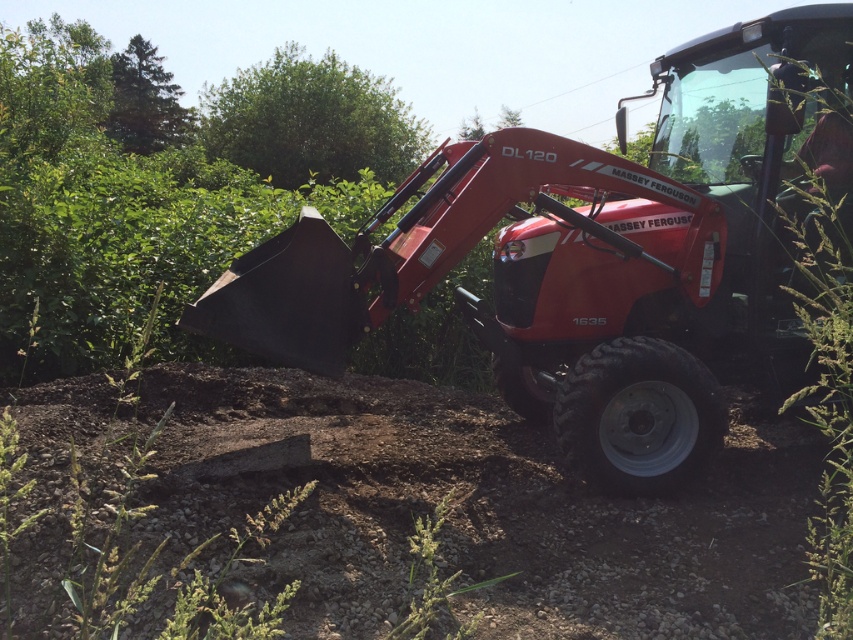
Looking at this image, you are operating a Massey Ferguson DL120 tractor with a loader bucket. You need to move the loader bucket to the brown gravel dirt track at lower center. Given the distance between the tractor and the track is 3.15 meters, can the loader bucket reach the track without moving the tractor?

The distance between the brown gravel dirt track at lower center and the camera is 3.15 meters. Since the loader bucket of the Massey Ferguson DL120 tractor has an extension range that typically reaches up to 3 meters, it cannot fully extend to 3.15 meters. Therefore, the loader bucket cannot reach the track without moving the tractor closer.

You are a farmer standing at the edge of your property. You need to drive the metallic red tractor at center to the barn located at the lower edge of the property. The path to the barn follows the brown gravel dirt track at lower center. Can the tractor safely navigate the track if the track is directly beneath the tractor?

The brown gravel dirt track at lower center is located below the metallic red tractor at center, so the tractor is already positioned over the track. Therefore, it can safely navigate the track to reach the barn.